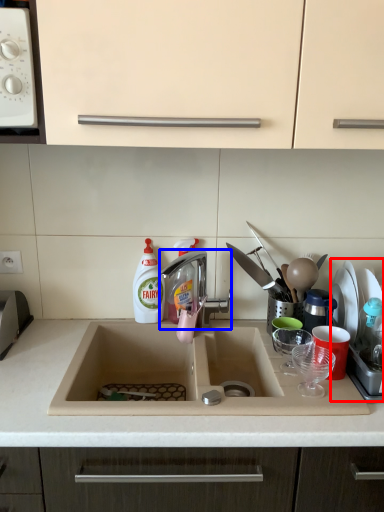
Question: Which object is closer to the camera taking this photo, appliance (highlighted by a red box) or tap (highlighted by a blue box)?

Choices:
 (A) appliance
 (B) tap

Answer: (A)